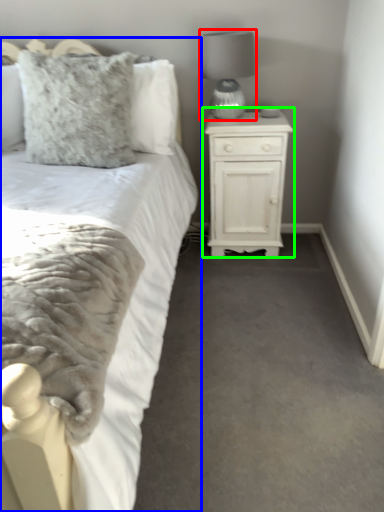
Question: Estimate the real-world distances between objects in this image. Which object is farther from lamp (highlighted by a red box), bed (highlighted by a blue box) or nightstand (highlighted by a green box)?

Choices:
 (A) bed
 (B) nightstand

Answer: (A)